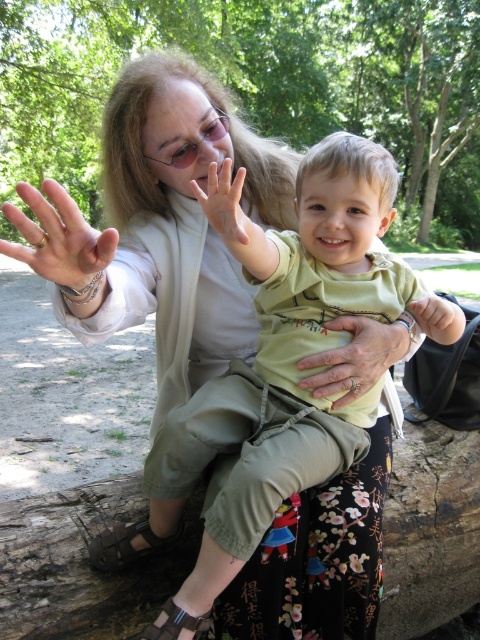
In the scene where a grandmother and her grandson are sitting on a tree trunk, you see a green matte shirt at center and a matte skin hand at center. Which object is positioned to the right of the other?

The green matte shirt at center is to the right of the matte skin hand at center.

You are a photographer trying to capture the perfect shot of the green matte shirt at center and the gold textured ring at center. If you want to ensure both are fully visible in the frame, which object should you focus on to avoid cropping?

The green matte shirt at center is wider than the gold textured ring at center. To ensure both are fully visible, focus on the green matte shirt at center since it requires more space in the frame.